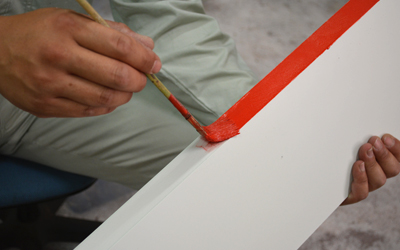
Locate an element on the screen. This screenshot has width=400, height=250. chair seat is located at coordinates (29, 184).